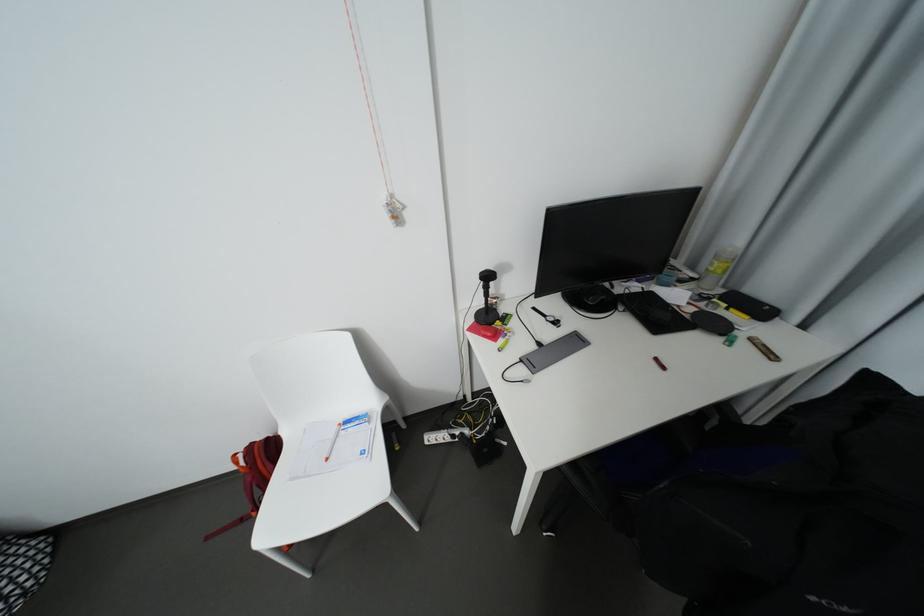
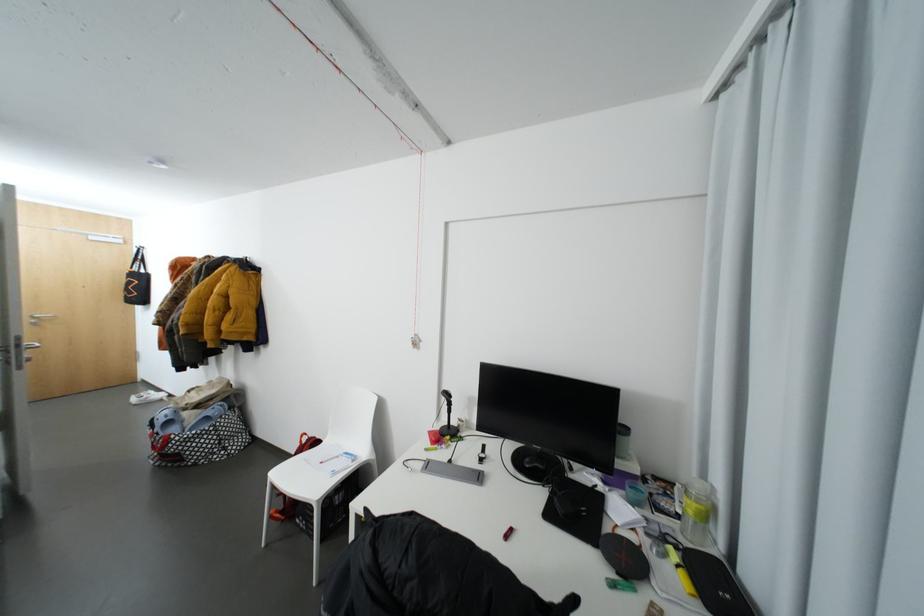
Locate, in the second image, the point that corresponds to [359,429] in the first image.

(350, 458)